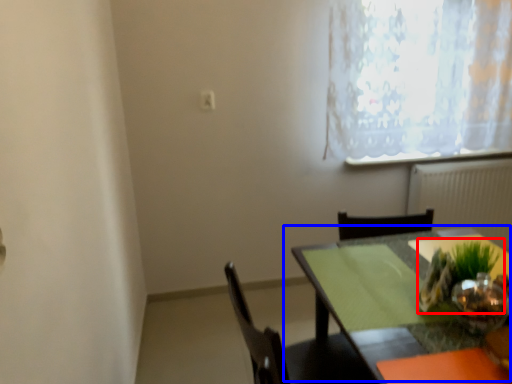
Question: Which object is closer to the camera taking this photo, houseplant (highlighted by a red box) or table (highlighted by a blue box)?

Choices:
 (A) houseplant
 (B) table

Answer: (B)